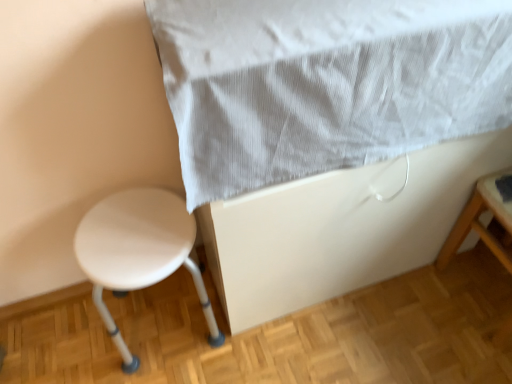
Where is `vacant space to the right of white plastic stool at lower left`? This screenshot has width=512, height=384. vacant space to the right of white plastic stool at lower left is located at coordinates (259, 349).